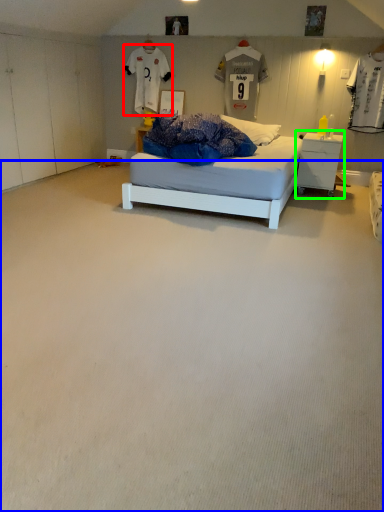
Question: Which object is positioned farthest from t shirt (highlighted by a red box)? Select from plain (highlighted by a blue box) and nightstand (highlighted by a green box).

Choices:
 (A) plain
 (B) nightstand

Answer: (A)